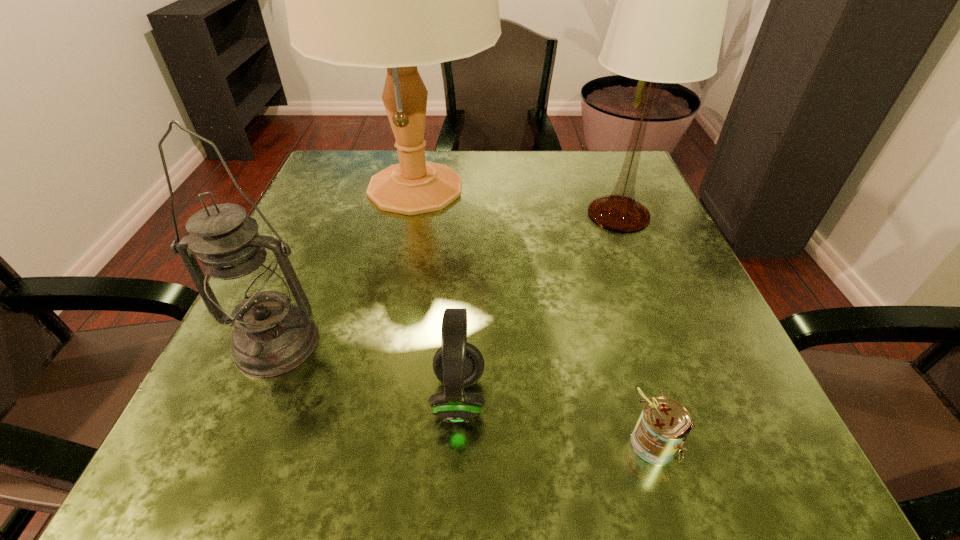
The height and width of the screenshot is (540, 960). In order to click on blank space located on the ear cups of the headset in this screenshot , I will do `click(760, 397)`.

This screenshot has height=540, width=960. Find the location of `vacant space situated 0.050m on the right of the can`. vacant space situated 0.050m on the right of the can is located at coordinates (719, 441).

Locate an element on the screen. The height and width of the screenshot is (540, 960). headset that is at the near edge is located at coordinates (457, 364).

Locate an element on the screen. Image resolution: width=960 pixels, height=540 pixels. can present at the near edge is located at coordinates pos(664,424).

Where is `table lamp present at the left edge`? The image size is (960, 540). table lamp present at the left edge is located at coordinates (397, 0).

The width and height of the screenshot is (960, 540). In order to click on oil lamp present at the left edge in this screenshot , I will do `click(245, 287)`.

Where is `table lamp at the right edge`? The image size is (960, 540). table lamp at the right edge is located at coordinates (667, 26).

At what (x,y) coordinates should I click in order to perform the action: click on can that is at the right edge. Please return your answer as a coordinate pair (x, y). The width and height of the screenshot is (960, 540). Looking at the image, I should click on (664, 424).

What are the coordinates of `object at the far left corner` in the screenshot? It's located at (397, 0).

Identify the location of object at the far right corner. Image resolution: width=960 pixels, height=540 pixels. pyautogui.click(x=667, y=26).